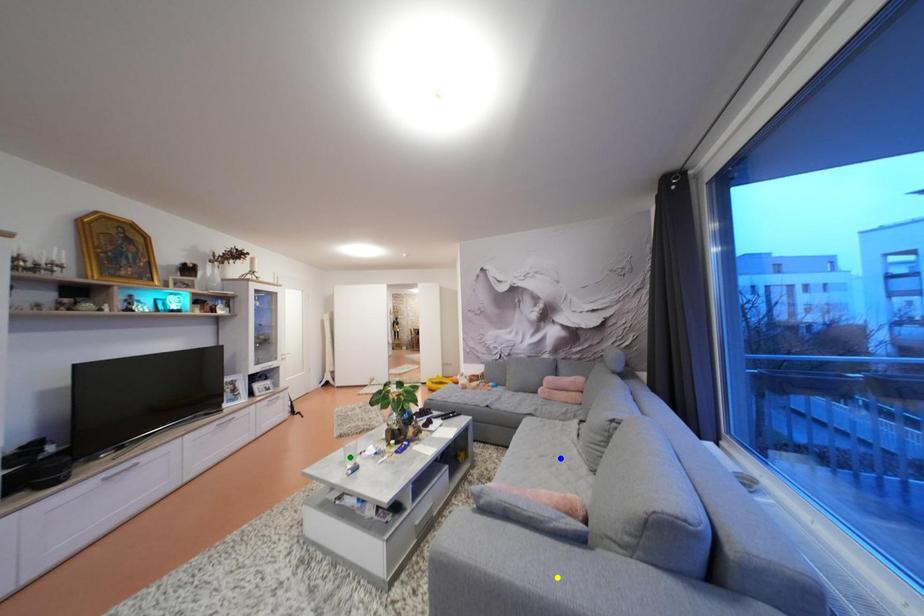
Order these from nearest to farthest:
blue point, yellow point, green point

green point, blue point, yellow point